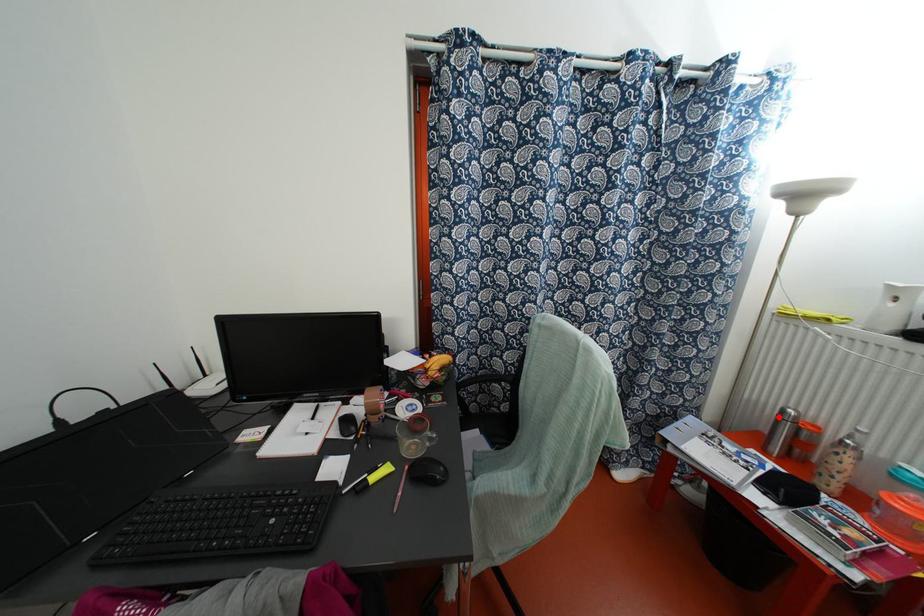
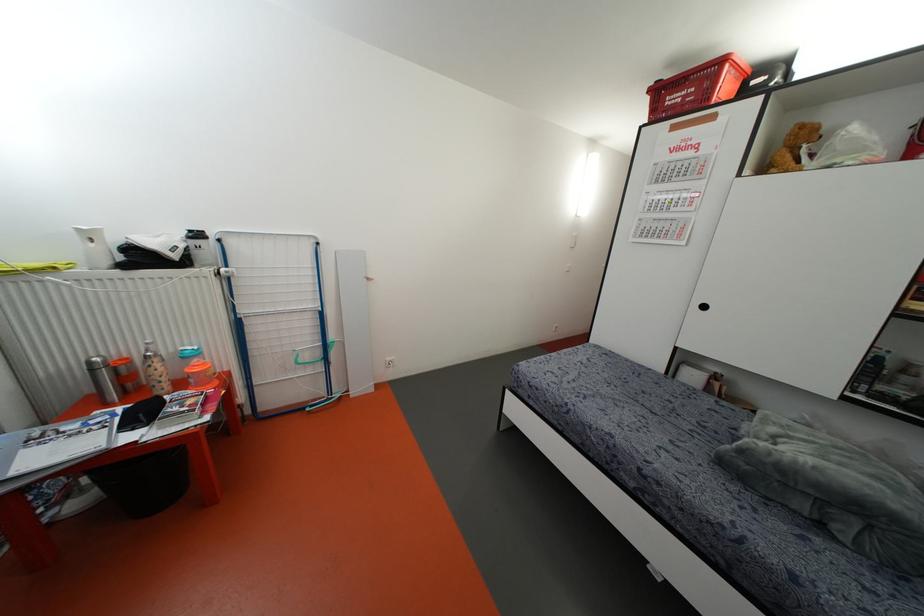
Where in the second image is the point corresponding to the highlighted location from the first image?

(91, 370)